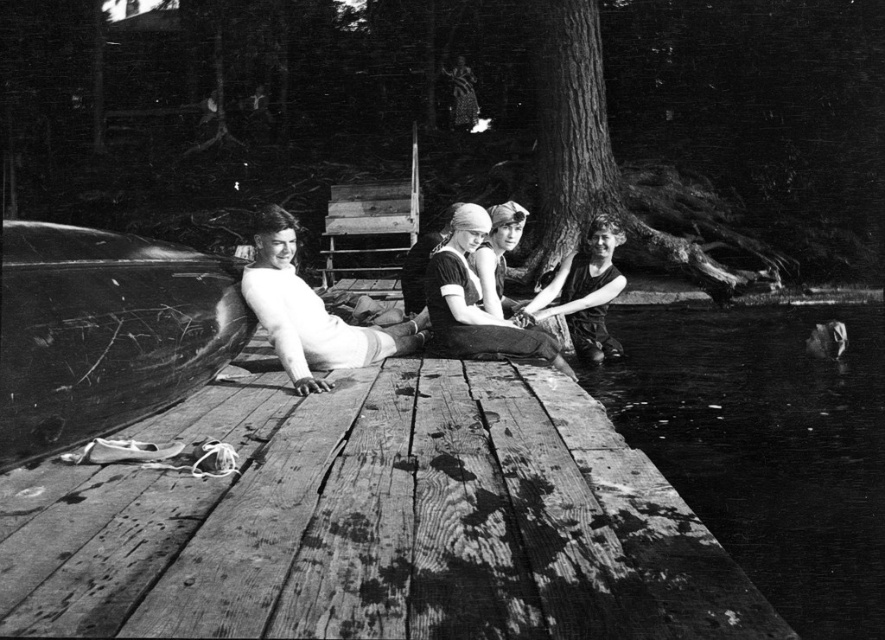
You are a photographer analyzing this black and white image. You notice two elements at the center of the dock scene. Which one is positioned lower in the image? The smooth white skin at center or the dark fabric swimsuit at center?

The smooth white skin at center is located below dark fabric swimsuit at center, so the smooth white skin at center is positioned lower in the image.

You are standing on the weathered wood dock at center and want to see the matte black swimsuit at center. Which direction should you look to see it?

The weathered wood dock at center is in front of matte black swimsuit at center, so you should look behind the weathered wood dock at center to see the matte black swimsuit at center.

You are standing on the wooden dock and want to move towards the dark water at lower right. Which direction should you walk relative to the matte black swimsuit at center?

You should walk to the right of the matte black swimsuit at center to reach the dark water at lower right since the dark water at lower right is located to the right of the matte black swimsuit at center.